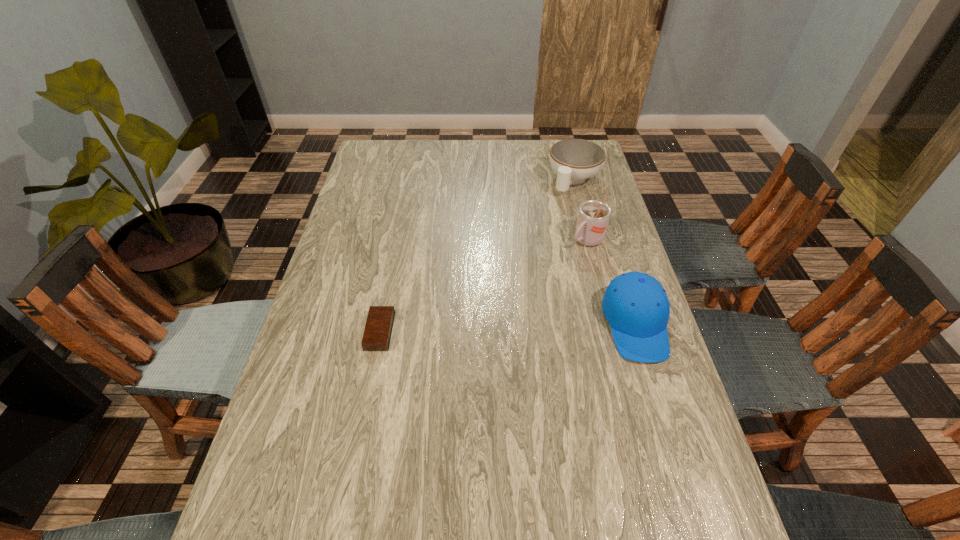
At what (x,y) coordinates should I click in order to perform the action: click on chinaware situated at the right edge. Please return your answer as a coordinate pair (x, y). This screenshot has height=540, width=960. Looking at the image, I should click on (574, 160).

Locate an element on the screen. The image size is (960, 540). object at the far right corner is located at coordinates (574, 160).

The height and width of the screenshot is (540, 960). What are the coordinates of `free space at the far edge of the desktop` in the screenshot? It's located at (473, 144).

You are a GUI agent. You are given a task and a screenshot of the screen. Output one action in this format:
    pyautogui.click(x=<x>, y=<y>)
    Task: Click on the free space at the near edge of the desktop
    The image size is (960, 540).
    Given the screenshot: What is the action you would take?
    pos(432,480)

The image size is (960, 540). In the image, there is a desktop. In order to click on free space at the left edge in this screenshot , I will do `click(323, 354)`.

This screenshot has height=540, width=960. I want to click on free space at the right edge of the desktop, so click(577, 260).

Find the location of a particular element. free space at the far left corner of the desktop is located at coordinates (388, 152).

In order to click on empty space that is in between the cup and the shortest object in this screenshot , I will do `click(483, 286)`.

Locate an element on the screen. This screenshot has height=540, width=960. free space between the cap and the leftmost object is located at coordinates (508, 328).

I want to click on free space between the cap and the leftmost object, so click(508, 328).